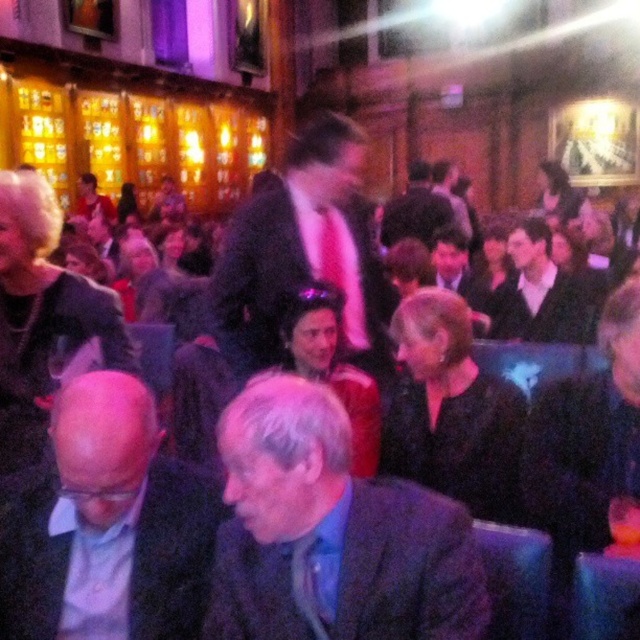
Question: Which point is closer to the camera?

Choices:
 (A) (401, 216)
 (B) (442, 636)

Answer: (B)

Question: Does bald head at center have a larger size compared to smooth black jacket at center?

Choices:
 (A) yes
 (B) no

Answer: (B)

Question: Which of the following is the farthest from the observer?

Choices:
 (A) matte black suit at center
 (B) dark gray suit at center

Answer: (A)

Question: Is matte black suit at center to the right of pink satin tie at center from the viewer's perspective?

Choices:
 (A) yes
 (B) no

Answer: (B)

Question: Which object appears farthest from the camera in this image?

Choices:
 (A) gray woolen suit at lower center
 (B) pink satin tie at center

Answer: (B)

Question: Does matte black suit at center have a lesser width compared to pink satin tie at center?

Choices:
 (A) yes
 (B) no

Answer: (B)